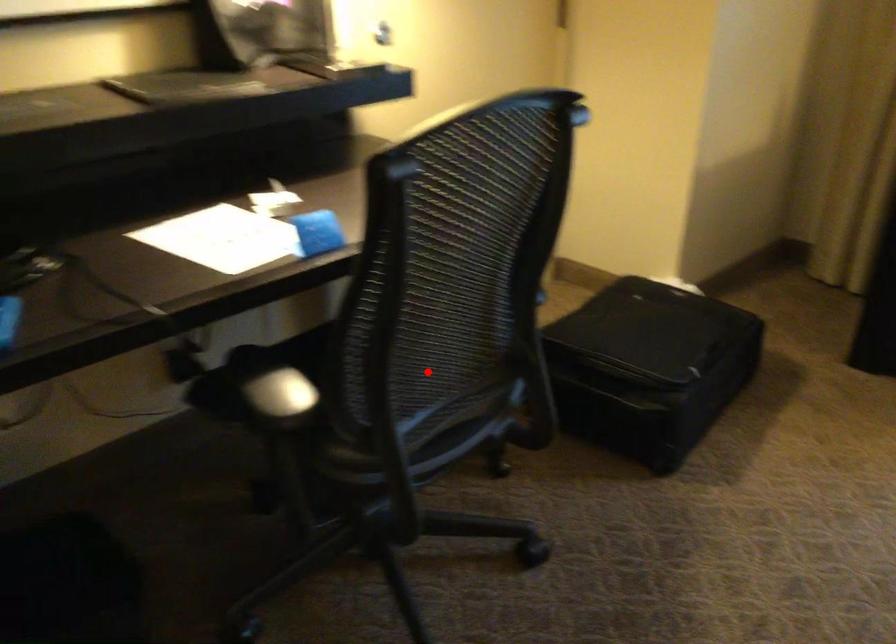
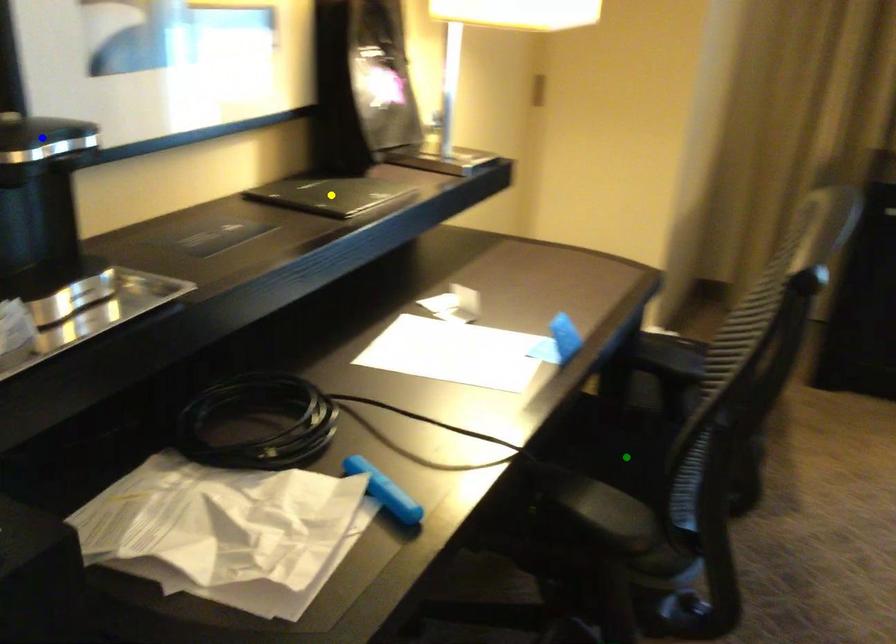
Question: I am providing you with two images of the same scene from different viewpoints. A red point is marked on the first image. You are given multiple points on the second image. Which point in image 2 represents the same 3d spot as the red point in image 1?

Choices:
 (A) green point
 (B) blue point
 (C) yellow point

Answer: (A)